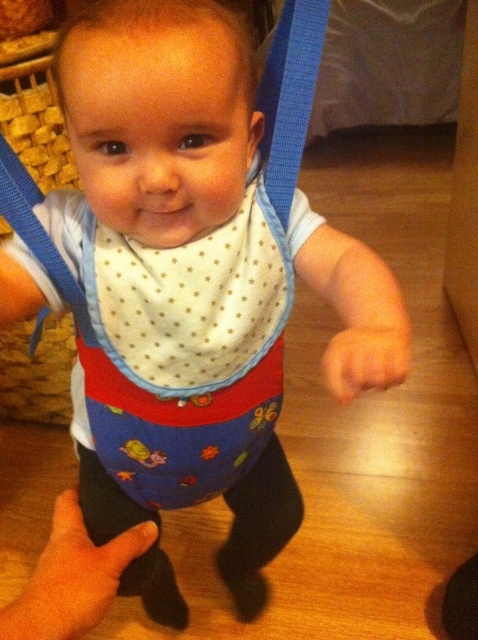
Can you confirm if white dotted fabric bib at center is shorter than blue fabric strap at upper center?

No, white dotted fabric bib at center is not shorter than blue fabric strap at upper center.

Is point (276, 220) positioned before point (292, 6)?

No.

The image size is (478, 640). I want to click on white dotted fabric bib at center, so click(191, 300).